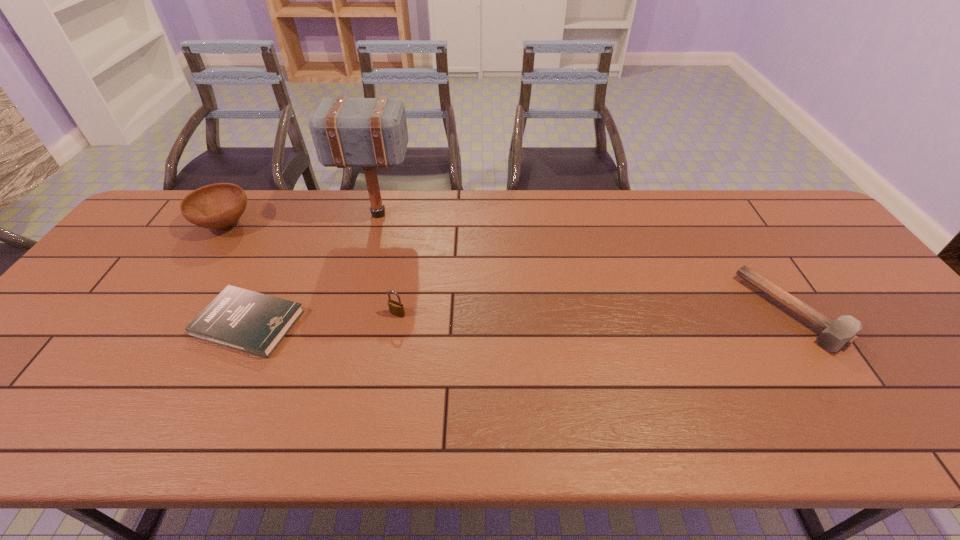
Where is `free region at the far left corner`? free region at the far left corner is located at coordinates (157, 222).

This screenshot has height=540, width=960. What are the coordinates of `vacant space at the far right corner` in the screenshot? It's located at (820, 227).

You are a GUI agent. You are given a task and a screenshot of the screen. Output one action in this format:
    pyautogui.click(x=<x>, y=<y>)
    Task: Click on the vacant area between the fourth tallest object and the bowl
    Image resolution: width=960 pixels, height=540 pixels.
    Given the screenshot: What is the action you would take?
    pyautogui.click(x=509, y=268)

Identify the location of vacant space in between the third shortest object and the taller mallet. (388, 264).

Where is `vacant space in between the shortest object and the padlock`? vacant space in between the shortest object and the padlock is located at coordinates (324, 319).

Locate an element on the screen. Image resolution: width=960 pixels, height=540 pixels. free space between the taller mallet and the book is located at coordinates (313, 269).

I want to click on free spot between the padlock and the taller mallet, so click(388, 264).

Identify the location of vacant point located between the padlock and the right mallet. (595, 312).

You are a GUI agent. You are given a task and a screenshot of the screen. Output one action in this format:
    pyautogui.click(x=<x>, y=<y>)
    Task: Click on the free space between the nearer mallet and the book
    
    Given the screenshot: What is the action you would take?
    pyautogui.click(x=521, y=317)

Where is `vacant space that's between the leftmost object and the fourth object from right to left`? vacant space that's between the leftmost object and the fourth object from right to left is located at coordinates (237, 274).